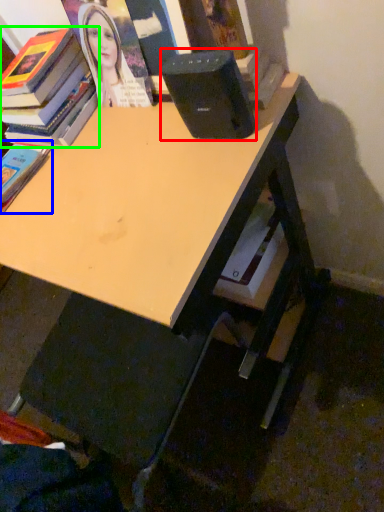
Question: Which object is positioned farthest from speaker (highlighted by a red box)? Select from book (highlighted by a blue box) and book (highlighted by a green box).

Choices:
 (A) book
 (B) book

Answer: (A)